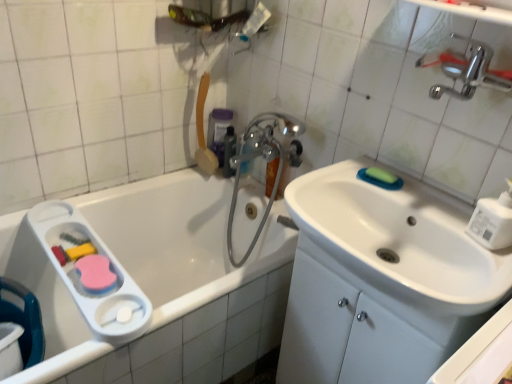
Where is `free space in front of green matte soap at upper right`? The height and width of the screenshot is (384, 512). free space in front of green matte soap at upper right is located at coordinates pyautogui.click(x=416, y=206).